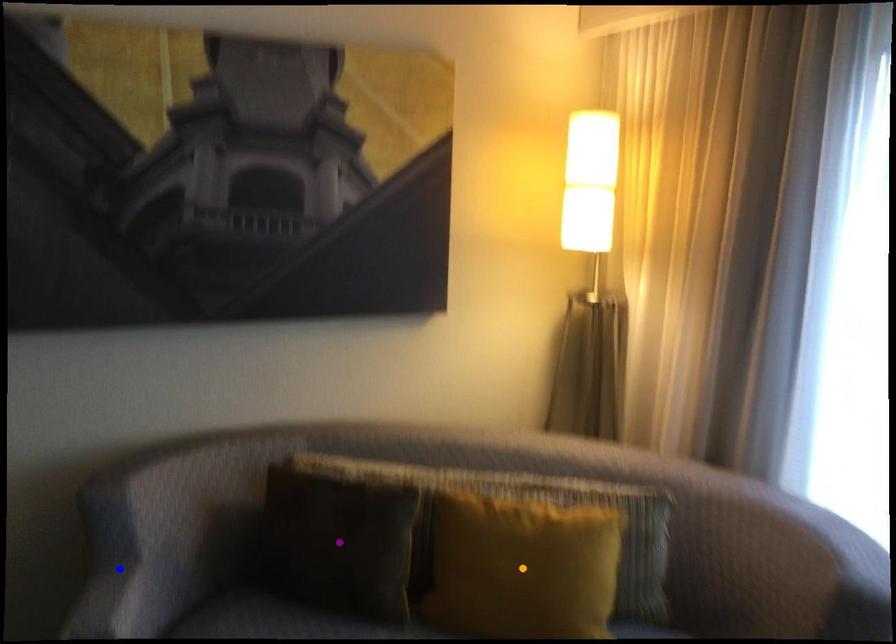
Based on the photo, order these from nearest to farthest:
1. orange point
2. blue point
3. purple point

1. orange point
2. purple point
3. blue point